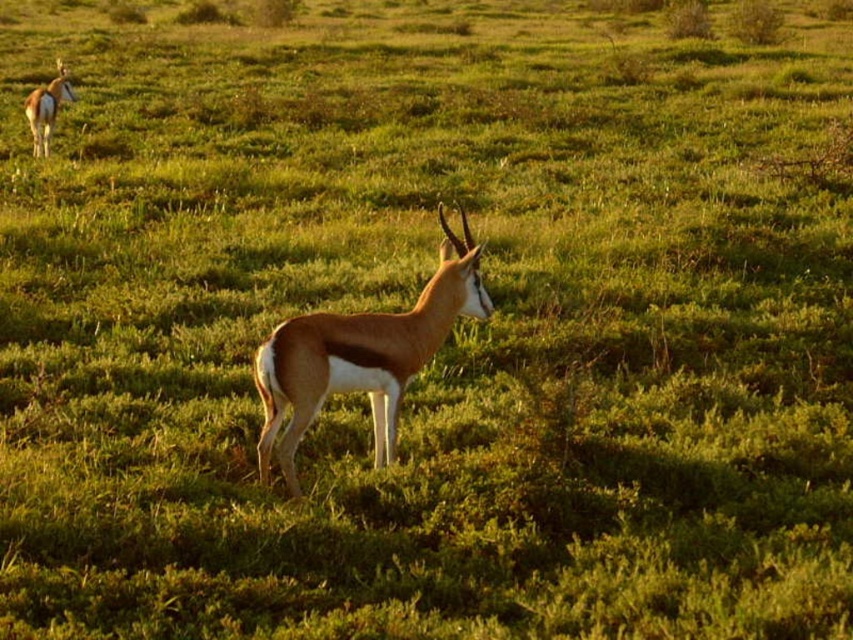
Is brown glossy antelope at center bigger than brown glossy antelope at upper left?

Indeed, brown glossy antelope at center has a larger size compared to brown glossy antelope at upper left.

Is brown glossy antelope at center shorter than brown glossy antelope at upper left?

Incorrect, brown glossy antelope at center's height does not fall short of brown glossy antelope at upper left's.

Image resolution: width=853 pixels, height=640 pixels. Identify the location of brown glossy antelope at center. (363, 355).